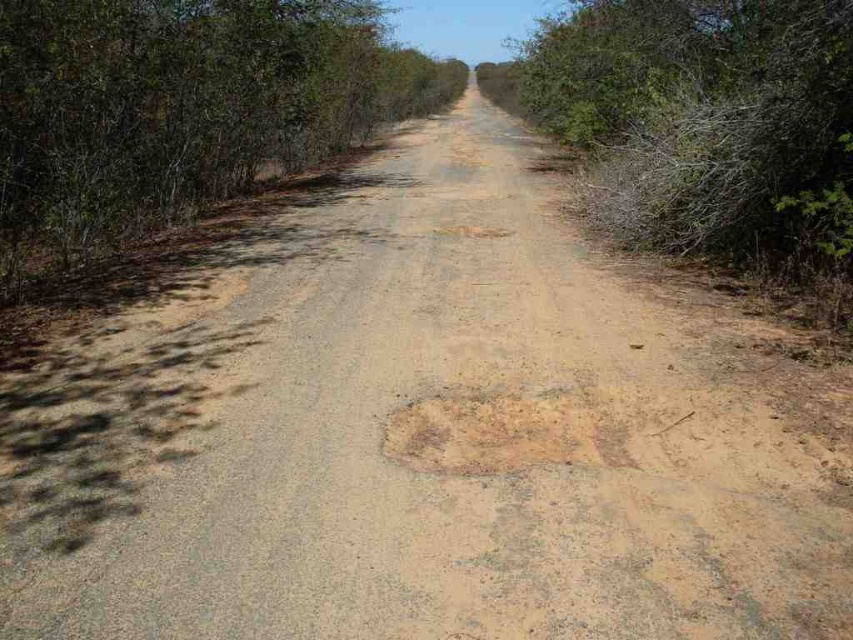
You are driving a car and want to park between the green leafy bush at left and the green leafy bush at right. Which direction should you turn to first approach the space between them?

You should turn to the left first to approach the space between the green leafy bush at left and the green leafy bush at right since the green leafy bush at left is positioned on the left side of the green leafy bush at right.

You are a hiker carrying a 3 meter wide tent. You see the green leafy bush at left and the brown textured patch at center. Which area can accommodate your tent without overlapping the other object?

The green leafy bush at left is wider than the brown textured patch at center, so the tent can fit in the area of the green leafy bush at left without overlapping the brown textured patch at center.